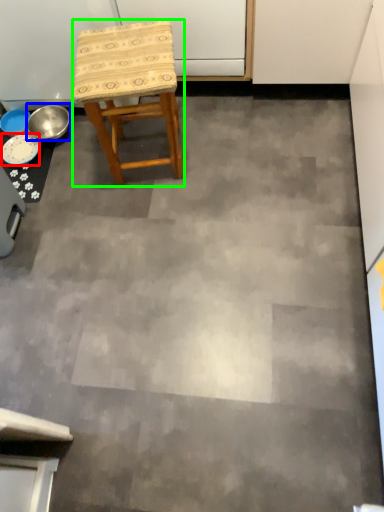
Question: Considering the real-world distances, which object is farthest from plate (highlighted by a red box)? bowl (highlighted by a blue box) or stool (highlighted by a green box)?

Choices:
 (A) bowl
 (B) stool

Answer: (B)